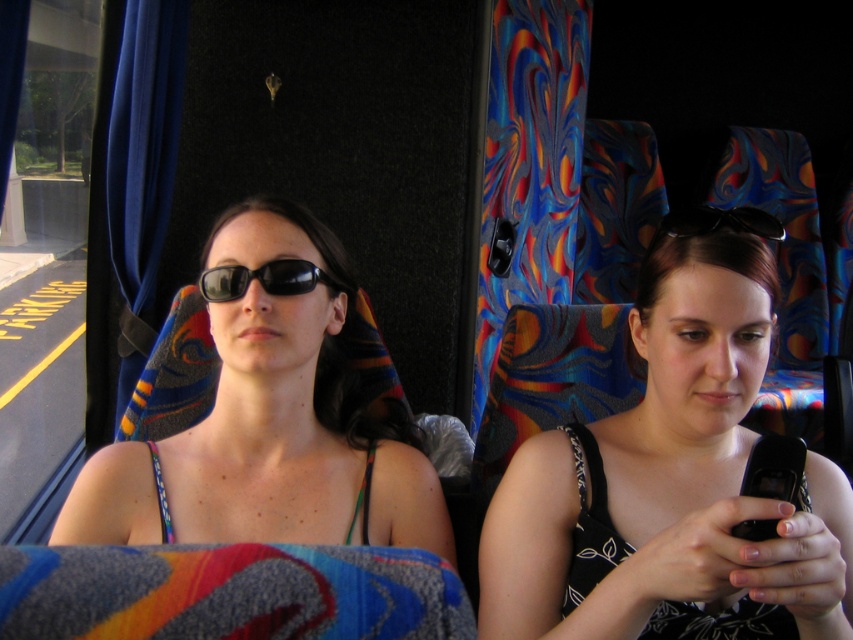
You are a passenger on the bus and want to check the time on your phone, but your matte black sunglasses at center are blocking your view. To move them out of the way, should you slide them to the left or right?

Since the matte black sunglasses at center are positioned at coordinates approximately 2.222 units from the left edge and 1.256 units from the top edge, sliding them to the right would move them away from the center and potentially out of your line of sight toward the window. However, without knowing the exact direction you need to look, it might be safer to slide them to the right to avoid obstruction while checking your phone.

You are a passenger on a bus and want to place your black fabric phone at center on the seat. The seat has a maximum weight capacity of 10 kilograms. Can you safely place your phone there?

The position of black fabric phone at center is at point (670,484), but this coordinate does not indicate the phone weight. The question cannot be answered with the given information.

You are a passenger on a bus and notice two pairs of sunglasses. The first is matte black sunglasses at center and the second is black plastic sunglasses at upper center. Which pair is located to the left of the other?

The matte black sunglasses at center is positioned on the left side of black plastic sunglasses at upper center.